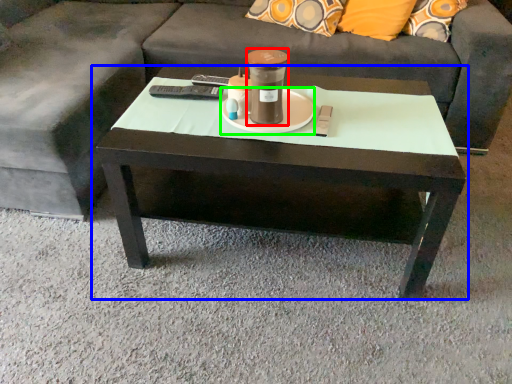
Question: Estimate the real-world distances between objects in this image. Which object is farther from beverage (highlighted by a red box), coffee table (highlighted by a blue box) or saucer (highlighted by a green box)?

Choices:
 (A) coffee table
 (B) saucer

Answer: (A)